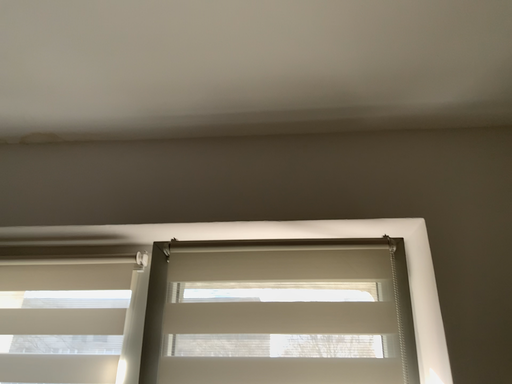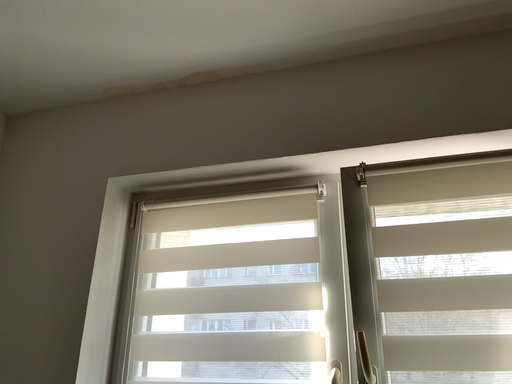
Question: Which way did the camera rotate in the video?

Choices:
 (A) rotated left
 (B) rotated right

Answer: (A)